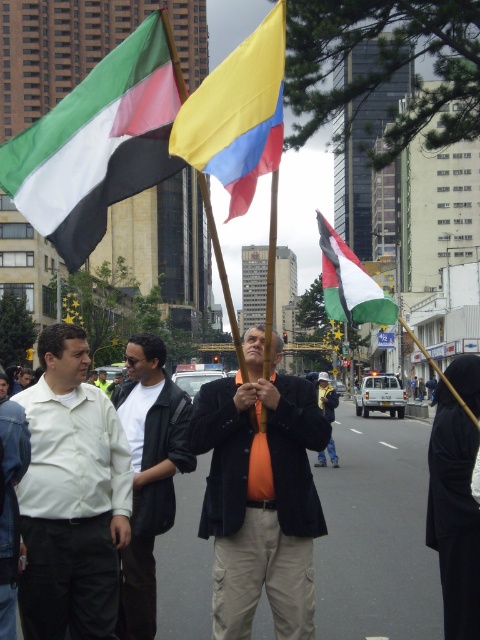
Is the position of green-white-red striped flag at center more distant than that of orange fabric at center?

Yes, green-white-red striped flag at center is behind orange fabric at center.

Can you confirm if green-white-red striped flag at center is thinner than orange fabric at center?

No, green-white-red striped flag at center is not thinner than orange fabric at center.

Locate an element on the screen. The width and height of the screenshot is (480, 640). green-white-red striped flag at center is located at coordinates (349, 284).

Is white matte shirt at left behind matte fabric flag at upper left?

Yes, white matte shirt at left is behind matte fabric flag at upper left.

Which of these two, white matte shirt at left or matte fabric flag at upper left, stands taller?

Standing taller between the two is matte fabric flag at upper left.

Locate an element on the screen. Image resolution: width=480 pixels, height=640 pixels. white matte shirt at left is located at coordinates (72, 497).

Who is positioned more to the left, yellow fabric flag at center or orange fabric at center?

yellow fabric flag at center is more to the left.

Describe the element at coordinates (238, 115) in the screenshot. This screenshot has height=640, width=480. I see `yellow fabric flag at center` at that location.

Does point (273, 60) come behind point (322, 387)?

No, it is in front of (322, 387).

This screenshot has width=480, height=640. What are the coordinates of `yellow fabric flag at center` in the screenshot? It's located at (238, 115).